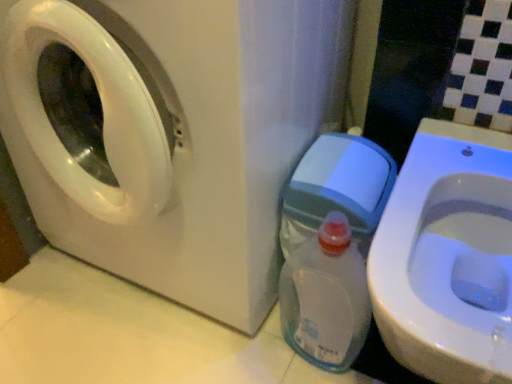
Locate an element on the screen. clear plastic bottle at lower right is located at coordinates pyautogui.click(x=326, y=297).

I want to click on clear plastic bottle at lower right, so [x=326, y=297].

Looking at this image, from the image's perspective, is white glossy toilet at lower right on top of white glossy washing machine at left?

Actually, white glossy toilet at lower right appears below white glossy washing machine at left in the image.

Can we say white glossy toilet at lower right lies outside white glossy washing machine at left?

Indeed, white glossy toilet at lower right is completely outside white glossy washing machine at left.

Considering the relative sizes of white glossy toilet at lower right and white glossy washing machine at left in the image provided, is white glossy toilet at lower right bigger than white glossy washing machine at left?

Actually, white glossy toilet at lower right might be smaller than white glossy washing machine at left.

Is white glossy toilet at lower right positioned before white glossy washing machine at left?

That is True.

Is white glossy toilet at lower right oriented away from clear plastic bottle at lower right?

No, white glossy toilet at lower right's orientation is not away from clear plastic bottle at lower right.

Who is more distant, white glossy toilet at lower right or clear plastic bottle at lower right?

clear plastic bottle at lower right is further away from the camera.

Can you confirm if white glossy toilet at lower right is wider than clear plastic bottle at lower right?

Yes, white glossy toilet at lower right is wider than clear plastic bottle at lower right.

Who is shorter, white glossy toilet at lower right or clear plastic bottle at lower right?

Standing shorter between the two is clear plastic bottle at lower right.

From a real-world perspective, between white glossy washing machine at left and clear plastic bottle at lower right, who is vertically lower?

clear plastic bottle at lower right, from a real-world perspective.

From the image's perspective, which one is positioned higher, white glossy washing machine at left or clear plastic bottle at lower right?

white glossy washing machine at left.

Can you tell me how much white glossy washing machine at left and clear plastic bottle at lower right differ in facing direction?

They differ by 0.0875 degrees in their facing directions.

Which object is thinner, clear plastic bottle at lower right or white glossy toilet at lower right?

Thinner between the two is clear plastic bottle at lower right.

Relative to white glossy toilet at lower right, is clear plastic bottle at lower right in front or behind?

Clearly, clear plastic bottle at lower right is behind white glossy toilet at lower right.

Is clear plastic bottle at lower right taller or shorter than white glossy toilet at lower right?

Considering their sizes, clear plastic bottle at lower right has less height than white glossy toilet at lower right.

How different are the orientations of clear plastic bottle at lower right and white glossy toilet at lower right in degrees?

clear plastic bottle at lower right and white glossy toilet at lower right are facing 6.3e-05 degrees away from each other.

Is white glossy washing machine at left at the right side of white glossy toilet at lower right?

In fact, white glossy washing machine at left is to the left of white glossy toilet at lower right.

From the image's perspective, is white glossy washing machine at left located above or below white glossy toilet at lower right?

From the image's perspective, white glossy washing machine at left appears above white glossy toilet at lower right.

Which object is more forward, white glossy washing machine at left or white glossy toilet at lower right?

white glossy toilet at lower right is more forward.

Choose the correct answer: Is white glossy washing machine at left inside white glossy toilet at lower right or outside it?

white glossy washing machine at left cannot be found inside white glossy toilet at lower right.

Does clear plastic bottle at lower right have a greater width compared to white glossy washing machine at left?

No.

Where is `washing machine to the left of clear plastic bottle at lower right`? washing machine to the left of clear plastic bottle at lower right is located at coordinates (170, 133).

Considering their positions, is clear plastic bottle at lower right located in front of or behind white glossy washing machine at left?

clear plastic bottle at lower right is positioned farther from the viewer than white glossy washing machine at left.

From a real-world perspective, which object stands above the other?

From a 3D spatial view, white glossy washing machine at left is above.

Where is `washing machine behind the white glossy toilet at lower right`? Image resolution: width=512 pixels, height=384 pixels. washing machine behind the white glossy toilet at lower right is located at coordinates (170, 133).

Where is `toilet above the clear plastic bottle at lower right (from the image's perspective)`? The width and height of the screenshot is (512, 384). toilet above the clear plastic bottle at lower right (from the image's perspective) is located at coordinates click(446, 255).

Based on their spatial positions, is white glossy toilet at lower right or white glossy washing machine at left further from clear plastic bottle at lower right?

Based on the image, white glossy washing machine at left appears to be further to clear plastic bottle at lower right.

When comparing their distances from clear plastic bottle at lower right, does white glossy washing machine at left or white glossy toilet at lower right seem further?

Among the two, white glossy washing machine at left is located further to clear plastic bottle at lower right.

Looking at the image, which one is located closer to white glossy washing machine at left, clear plastic bottle at lower right or white glossy toilet at lower right?

clear plastic bottle at lower right is positioned closer to the anchor white glossy washing machine at left.

Consider the image. Looking at the image, which one is located closer to white glossy washing machine at left, white glossy toilet at lower right or clear plastic bottle at lower right?

clear plastic bottle at lower right is positioned closer to the anchor white glossy washing machine at left.

Considering their positions, is white glossy washing machine at left positioned closer to white glossy toilet at lower right than clear plastic bottle at lower right?

The object closer to white glossy toilet at lower right is clear plastic bottle at lower right.

Estimate the real-world distances between objects in this image. Which object is closer to white glossy toilet at lower right, clear plastic bottle at lower right or white glossy washing machine at left?

Among the two, clear plastic bottle at lower right is located nearer to white glossy toilet at lower right.

The height and width of the screenshot is (384, 512). What are the coordinates of `baby bottle situated between white glossy washing machine at left and white glossy toilet at lower right from left to right` in the screenshot? It's located at (326, 297).